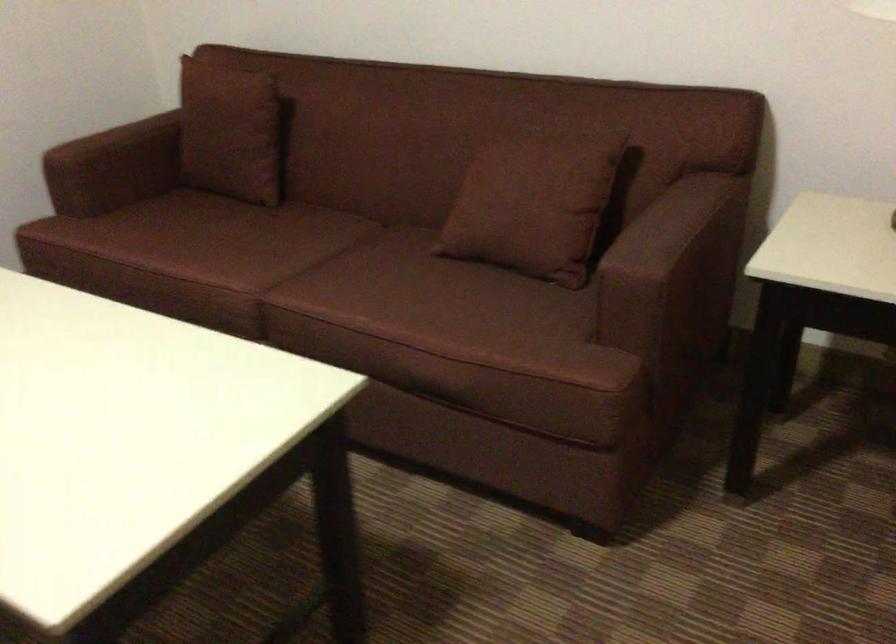
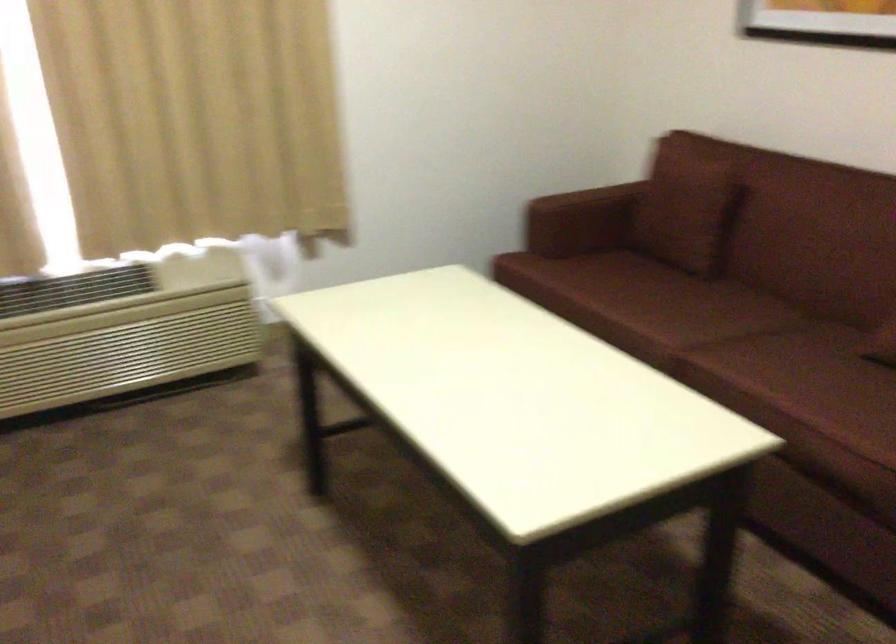
Where in the second image is the point corresponding to point 123,174 from the first image?

(573, 225)